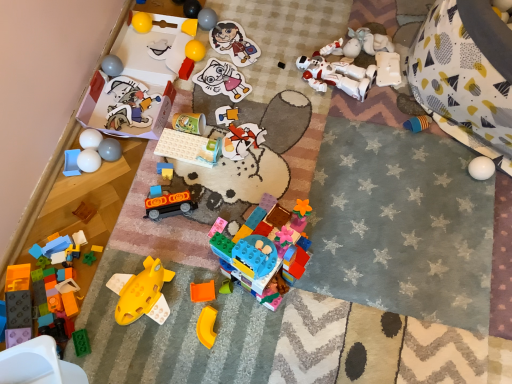
I want to click on vacant area that lies between matte plastic sticker at upper center, marked as the fourth toy in a right-to-left arrangement, and white matte robot at center, marked as the third toy in a right-to-left arrangement, so click(x=274, y=60).